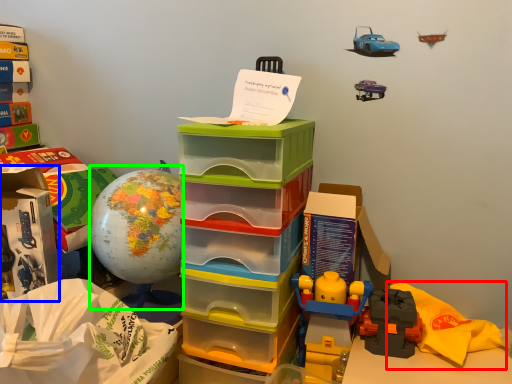
Question: Which is farther away from material (highlighted by a red box)? storage box (highlighted by a blue box) or toy (highlighted by a green box)?

Choices:
 (A) storage box
 (B) toy

Answer: (A)